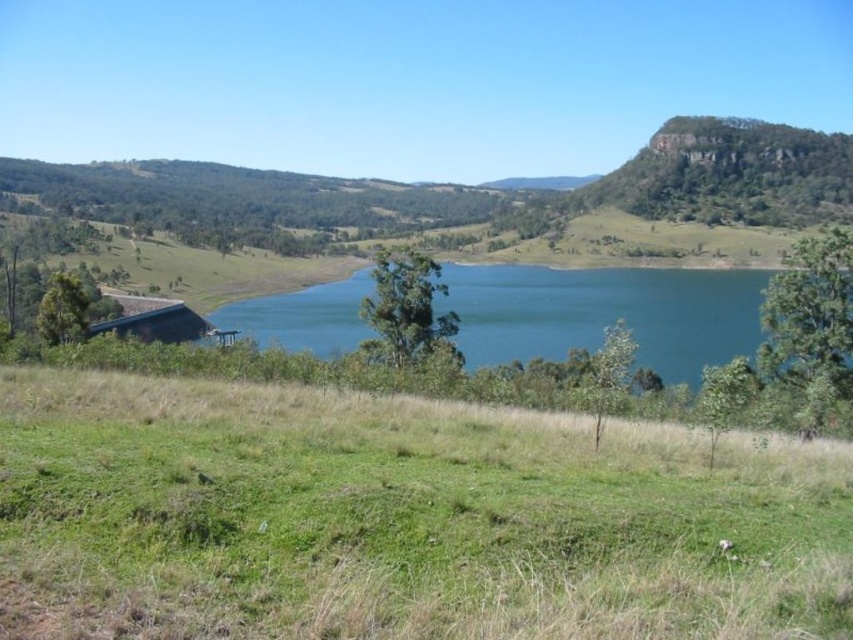
Question: Which object is closer to the camera taking this photo?

Choices:
 (A) blue water at center
 (B) rustic wooden hut at lower left
 (C) green grassy hillside at lower center

Answer: (C)

Question: Is the position of blue water at center less distant than that of rustic wooden hut at lower left?

Choices:
 (A) yes
 (B) no

Answer: (A)

Question: Is the position of green grassy hillside at lower center less distant than that of rustic wooden hut at lower left?

Choices:
 (A) no
 (B) yes

Answer: (B)

Question: Among these points, which one is farthest from the camera?

Choices:
 (A) tap(741, 276)
 (B) tap(248, 426)

Answer: (A)

Question: Can you confirm if green grassy hillside at lower center is positioned to the left of rustic wooden hut at lower left?

Choices:
 (A) no
 (B) yes

Answer: (A)

Question: Which object is closer to the camera taking this photo?

Choices:
 (A) rustic wooden hut at lower left
 (B) green grassy hillside at lower center
 (C) blue water at center

Answer: (B)